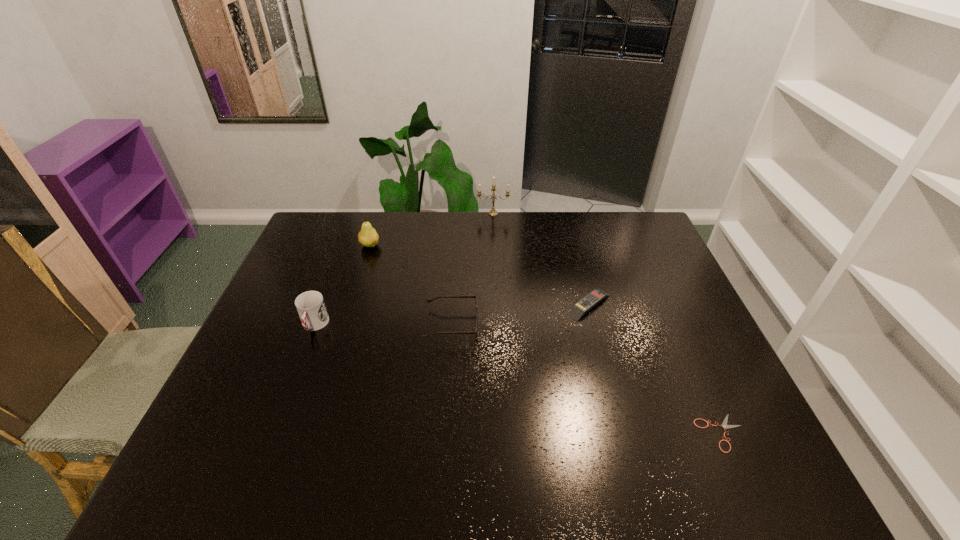
Locate an element on the screen. This screenshot has height=540, width=960. object located at the left edge is located at coordinates (310, 305).

Where is `object that is at the right edge`? Image resolution: width=960 pixels, height=540 pixels. object that is at the right edge is located at coordinates (724, 424).

This screenshot has width=960, height=540. In order to click on object at the near right corner in this screenshot , I will do `click(724, 424)`.

Where is `vacant region at the far edge of the desktop`? The image size is (960, 540). vacant region at the far edge of the desktop is located at coordinates (542, 211).

You are a GUI agent. You are given a task and a screenshot of the screen. Output one action in this format:
    pyautogui.click(x=<x>, y=<y>)
    Task: Click on the vacant position at the near edge of the desktop
    This screenshot has height=540, width=960.
    Given the screenshot: What is the action you would take?
    pyautogui.click(x=441, y=468)

Locate an element on the screen. The height and width of the screenshot is (540, 960). vacant area at the left edge of the desktop is located at coordinates (241, 384).

Find the location of `free region at the right edge of the desktop`. free region at the right edge of the desktop is located at coordinates (696, 313).

The height and width of the screenshot is (540, 960). What are the coordinates of `free region at the near left corner of the desktop` in the screenshot? It's located at (196, 458).

Identify the location of free space at the far right corner. (641, 240).

I want to click on empty location between the farthest object and the fifth nearest object, so click(432, 230).